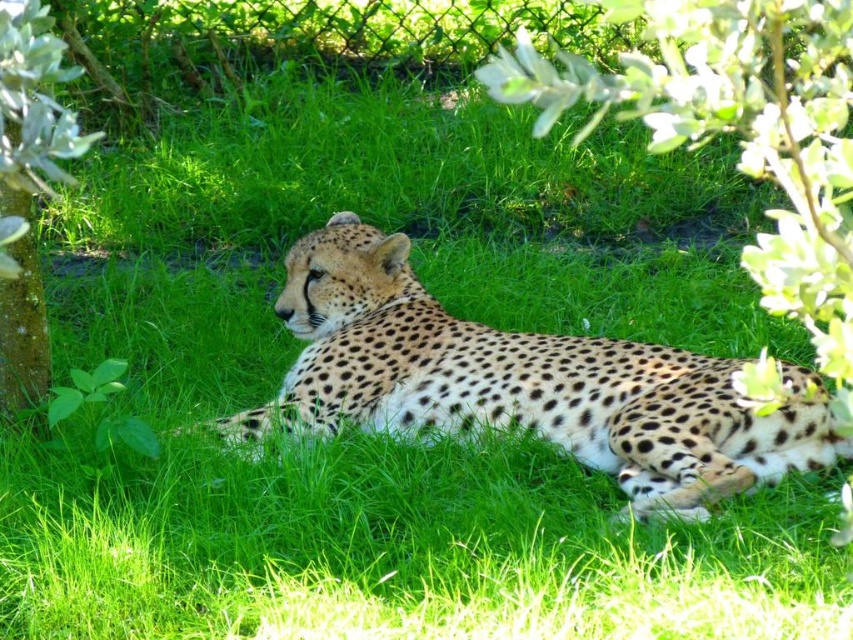
Question: Which point is closer to the camera?

Choices:
 (A) spotted fur cheetah at center
 (B) green leafy bush at left

Answer: (B)

Question: Which of the following is the closest to the observer?

Choices:
 (A) (27, 337)
 (B) (677, 435)

Answer: (B)

Question: Does spotted fur cheetah at center appear on the right side of green leafy bush at left?

Choices:
 (A) yes
 (B) no

Answer: (A)

Question: Which point is farther to the camera?

Choices:
 (A) green leafy bush at left
 (B) spotted fur cheetah at center

Answer: (B)

Question: Does spotted fur cheetah at center appear over green leafy bush at left?

Choices:
 (A) no
 (B) yes

Answer: (A)

Question: Is spotted fur cheetah at center positioned behind green leafy bush at left?

Choices:
 (A) yes
 (B) no

Answer: (A)